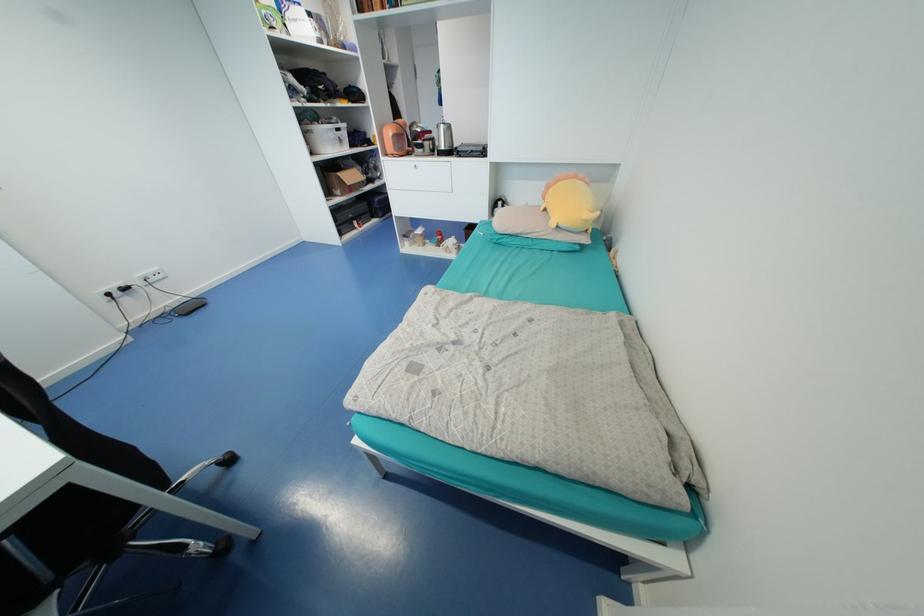
What do you see at coordinates (415, 167) in the screenshot?
I see `the white drawer handle` at bounding box center [415, 167].